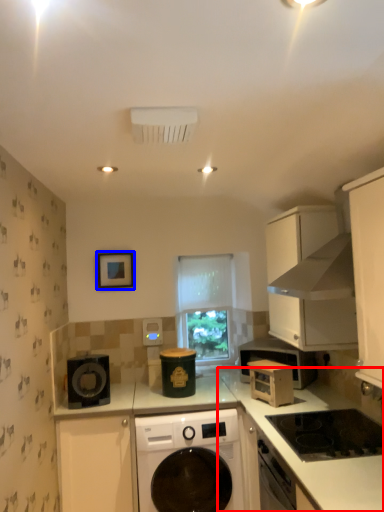
Question: Which object is further to the camera taking this photo, counter top (highlighted by a red box) or picture frame (highlighted by a blue box)?

Choices:
 (A) counter top
 (B) picture frame

Answer: (B)